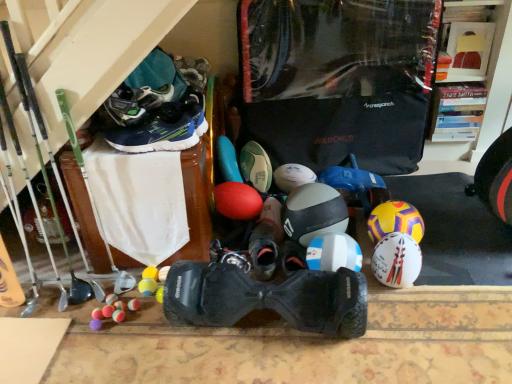
Where is `vacant area that lies between white matte helmet at right, arranged as the 1th helmet when viewed from the right, and white matte helmet at center, the 2th helmet when ordered from right to left`? This screenshot has height=384, width=512. vacant area that lies between white matte helmet at right, arranged as the 1th helmet when viewed from the right, and white matte helmet at center, the 2th helmet when ordered from right to left is located at coordinates (417, 272).